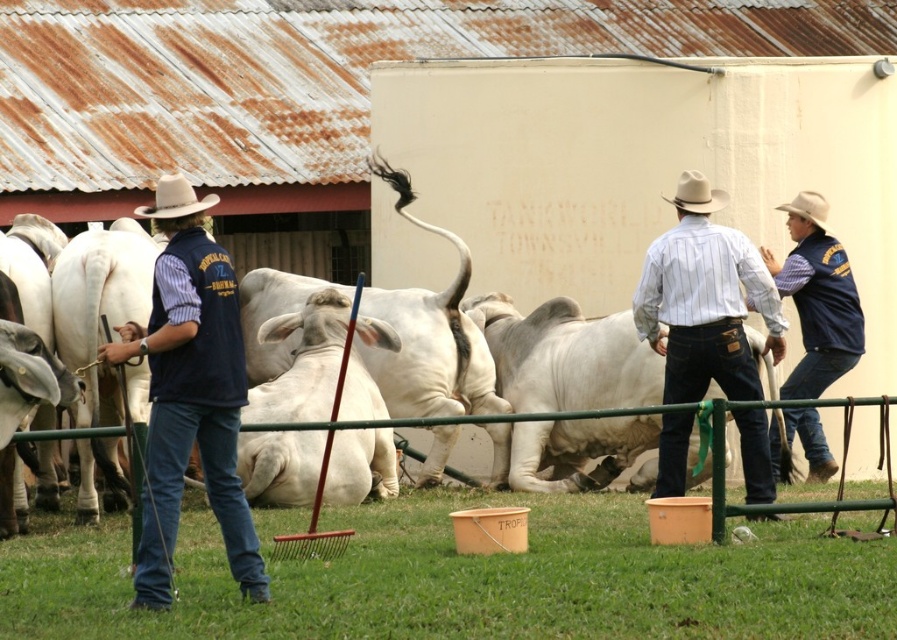
Is white felt cowboy hat at left thinner than white felt cowboy hat at center?

No, white felt cowboy hat at left is not thinner than white felt cowboy hat at center.

Which is more to the right, white felt cowboy hat at left or white felt cowboy hat at center?

From the viewer's perspective, white felt cowboy hat at center appears more on the right side.

Is point (155, 186) farther from camera compared to point (691, 205)?

Yes, it is behind point (691, 205).

Identify the location of white felt cowboy hat at left. (175, 198).

Between point (192, 324) and point (189, 214), which one is positioned in front?

Point (192, 324) is in front.

Locate an element on the screen. The image size is (897, 640). matte blue vest at left is located at coordinates (190, 392).

Is the position of blue denim jeans at right less distant than that of white matte cowboy hat at upper right?

That is True.

Measure the distance between point (808, 465) and camera.

Point (808, 465) is 65.99 meters from camera.

Where is `blue denim jeans at right`? The image size is (897, 640). blue denim jeans at right is located at coordinates (817, 298).